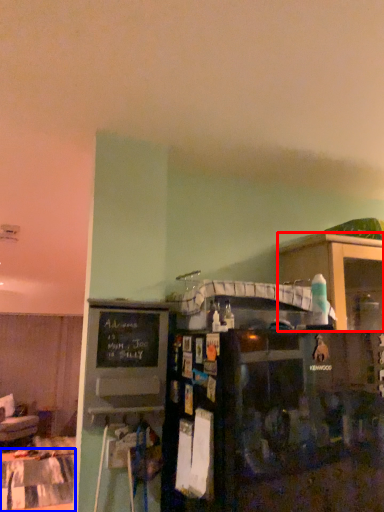
Question: Among these objects, which one is nearest to the camera, shelf (highlighted by a red box) or table (highlighted by a blue box)?

Choices:
 (A) shelf
 (B) table

Answer: (A)